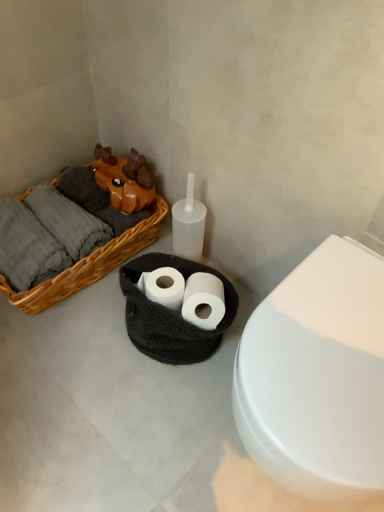
The image size is (384, 512). What are the coordinates of `white paper at center, which is the first toilet paper in right-to-left order` in the screenshot? It's located at [204, 300].

Where is `black crocheted basket at center`? The height and width of the screenshot is (512, 384). black crocheted basket at center is located at coordinates (170, 314).

Find the location of a particular element. The width and height of the screenshot is (384, 512). white matte toilet paper at center, placed as the second toilet paper when sorted from right to left is located at coordinates (165, 287).

Locate an element on the screen. woven wood basket at left is located at coordinates (89, 265).

Is white matte toilet paper at center, placed as the second toilet paper when sorted from right to left, looking in the opposite direction of woven wood basket at left?

No, white matte toilet paper at center, placed as the second toilet paper when sorted from right to left, is not facing the opposite direction of woven wood basket at left.

From a real-world perspective, which object rests below the other?

woven wood basket at left.

From the image's perspective, would you say white matte toilet paper at center, which appears as the first toilet paper when viewed from the left, is shown under woven wood basket at left?

Yes.

Is white matte toilet paper at center, placed as the second toilet paper when sorted from right to left, not within woven wood basket at left?

Yes, white matte toilet paper at center, placed as the second toilet paper when sorted from right to left, is located beyond the bounds of woven wood basket at left.

Are white matte toilet paper at center, which appears as the first toilet paper when viewed from the left, and white glossy toilet at center right far apart?

No.

What's the angular difference between white matte toilet paper at center, which appears as the first toilet paper when viewed from the left, and white glossy toilet at center right's facing directions?

28 degrees.

Which of these two, white matte toilet paper at center, which appears as the first toilet paper when viewed from the left, or white glossy toilet at center right, is thinner?

white matte toilet paper at center, which appears as the first toilet paper when viewed from the left.

Considering the points (151, 287) and (310, 456), which point is behind, point (151, 287) or point (310, 456)?

Point (151, 287)

Is black crocheted basket at center inside or outside of white glossy toilet at center right?

black crocheted basket at center is not inside white glossy toilet at center right, it's outside.

Between black crocheted basket at center and white glossy toilet at center right, which one has larger width?

With larger width is white glossy toilet at center right.

In the scene shown: Considering the relative positions of black crocheted basket at center and white glossy toilet at center right in the image provided, is black crocheted basket at center behind white glossy toilet at center right?

Yes, it is.

In the scene shown: Is white paper at center, which is the first toilet paper in right-to-left order, beside woven wood basket at left?

No, white paper at center, which is the first toilet paper in right-to-left order, is not in contact with woven wood basket at left.

Can you confirm if white paper at center, which is the first toilet paper in right-to-left order, is bigger than woven wood basket at left?

Actually, white paper at center, which is the first toilet paper in right-to-left order, might be smaller than woven wood basket at left.

From a real-world perspective, between white paper at center, placed as the second toilet paper when sorted from left to right, and woven wood basket at left, who is vertically higher?

From a 3D spatial view, white paper at center, placed as the second toilet paper when sorted from left to right, is above.

Measure the distance between white glossy toilet at center right and woven wood basket at left.

72.73 centimeters.

Is white glossy toilet at center right aimed at woven wood basket at left?

No, white glossy toilet at center right does not turn towards woven wood basket at left.

Identify the location of toilet located on the right of woven wood basket at left. The width and height of the screenshot is (384, 512). point(317,375).

Considering the relative sizes of white glossy toilet at center right and woven wood basket at left in the image provided, is white glossy toilet at center right smaller than woven wood basket at left?

Actually, white glossy toilet at center right might be larger than woven wood basket at left.

Does white matte toilet paper at center, which appears as the first toilet paper when viewed from the left, come in front of black crocheted basket at center?

That is False.

Based on the photo, in terms of width, does white matte toilet paper at center, which appears as the first toilet paper when viewed from the left, look wider or thinner when compared to black crocheted basket at center?

Considering their sizes, white matte toilet paper at center, which appears as the first toilet paper when viewed from the left, looks slimmer than black crocheted basket at center.

From a real-world perspective, is white matte toilet paper at center, placed as the second toilet paper when sorted from right to left, below black crocheted basket at center?

No, from a real-world perspective, white matte toilet paper at center, placed as the second toilet paper when sorted from right to left, is not below black crocheted basket at center.

Considering the relative positions of white matte toilet paper at center, placed as the second toilet paper when sorted from right to left, and black crocheted basket at center in the image provided, is white matte toilet paper at center, placed as the second toilet paper when sorted from right to left, to the left of black crocheted basket at center from the viewer's perspective?

Yes.

From a real-world perspective, is white matte toilet paper at center, which appears as the first toilet paper when viewed from the left, on white paper at center, placed as the second toilet paper when sorted from left to right?

No.

How different are the orientations of white matte toilet paper at center, placed as the second toilet paper when sorted from right to left, and white paper at center, placed as the second toilet paper when sorted from left to right, in degrees?

white matte toilet paper at center, placed as the second toilet paper when sorted from right to left, and white paper at center, placed as the second toilet paper when sorted from left to right, are facing 12.8 degrees away from each other.

In the scene shown: Which point is more distant from viewer, [154,270] or [210,327]?

The point [154,270] is farther.

Is white matte toilet paper at center, which appears as the first toilet paper when viewed from the left, not close to white paper at center, placed as the second toilet paper when sorted from left to right?

No.

Locate an element on the screen. toilet paper behind the woven wood basket at left is located at coordinates (165, 287).

Where is `toilet that appears on the right of white matte toilet paper at center, placed as the second toilet paper when sorted from right to left`? toilet that appears on the right of white matte toilet paper at center, placed as the second toilet paper when sorted from right to left is located at coordinates (317, 375).

Considering their positions, is woven wood basket at left positioned further to white matte toilet paper at center, which appears as the first toilet paper when viewed from the left, than white paper at center, placed as the second toilet paper when sorted from left to right?

Based on the image, woven wood basket at left appears to be further to white matte toilet paper at center, which appears as the first toilet paper when viewed from the left.

Which object lies further to the anchor point black crocheted basket at center, woven wood basket at left or white matte toilet paper at center, which appears as the first toilet paper when viewed from the left?

Based on the image, woven wood basket at left appears to be further to black crocheted basket at center.

Which object lies nearer to the anchor point woven wood basket at left, white paper at center, which is the first toilet paper in right-to-left order, or white glossy toilet at center right?

white paper at center, which is the first toilet paper in right-to-left order.

From the image, which object appears to be nearer to white matte toilet paper at center, which appears as the first toilet paper when viewed from the left, white glossy toilet at center right or black crocheted basket at center?

black crocheted basket at center.

Looking at the image, which one is located closer to black crocheted basket at center, white matte toilet paper at center, which appears as the first toilet paper when viewed from the left, or white paper at center, placed as the second toilet paper when sorted from left to right?

white matte toilet paper at center, which appears as the first toilet paper when viewed from the left, is positioned closer to the anchor black crocheted basket at center.

Estimate the real-world distances between objects in this image. Which object is closer to white paper at center, which is the first toilet paper in right-to-left order, white glossy toilet at center right or woven wood basket at left?

woven wood basket at left lies closer to white paper at center, which is the first toilet paper in right-to-left order, than the other object.

Looking at the image, which one is located further to white matte toilet paper at center, which appears as the first toilet paper when viewed from the left, white glossy toilet at center right or woven wood basket at left?

white glossy toilet at center right is further to white matte toilet paper at center, which appears as the first toilet paper when viewed from the left.

Looking at the image, which one is located closer to white glossy toilet at center right, black crocheted basket at center or woven wood basket at left?

black crocheted basket at center is positioned closer to the anchor white glossy toilet at center right.

The width and height of the screenshot is (384, 512). In order to click on basket container between white matte toilet paper at center, which appears as the first toilet paper when viewed from the left, and white paper at center, placed as the second toilet paper when sorted from left to right, in the horizontal direction in this screenshot , I will do `click(170, 314)`.

Locate an element on the screen. basket container between white glossy toilet at center right and white paper at center, placed as the second toilet paper when sorted from left to right, along the z-axis is located at coordinates (170, 314).

In order to click on toilet paper located between woven wood basket at left and white paper at center, placed as the second toilet paper when sorted from left to right, in the left-right direction in this screenshot , I will do `click(165, 287)`.

Find the location of a particular element. The image size is (384, 512). toilet paper positioned between white glossy toilet at center right and white matte toilet paper at center, which appears as the first toilet paper when viewed from the left, from near to far is located at coordinates (204, 300).